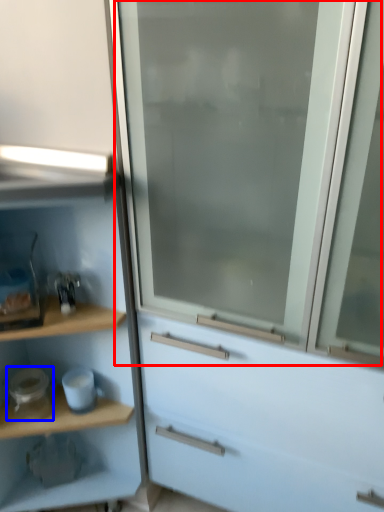
Question: Which point is closer to the camera, screen door (highlighted by a red box) or appliance (highlighted by a blue box)?

Choices:
 (A) screen door
 (B) appliance

Answer: (A)